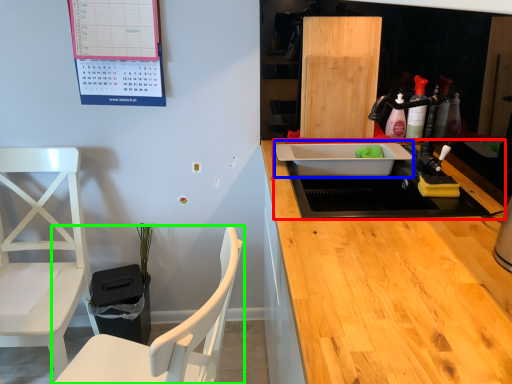
Question: Considering the real-world distances, which object is closest to sink (highlighted by a red box)? sink (highlighted by a blue box) or chair (highlighted by a green box).

Choices:
 (A) sink
 (B) chair

Answer: (A)